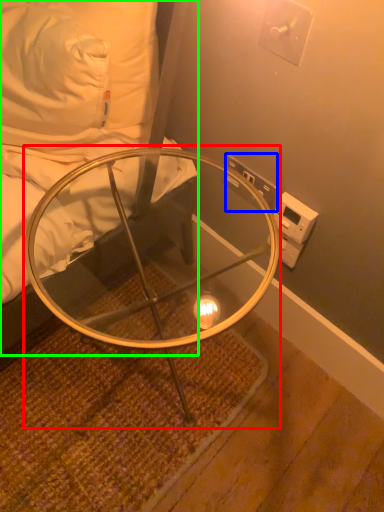
Question: Which is nearer to the table (highlighted by a red box)? electric outlet (highlighted by a blue box) or furniture (highlighted by a green box).

Choices:
 (A) electric outlet
 (B) furniture

Answer: (B)